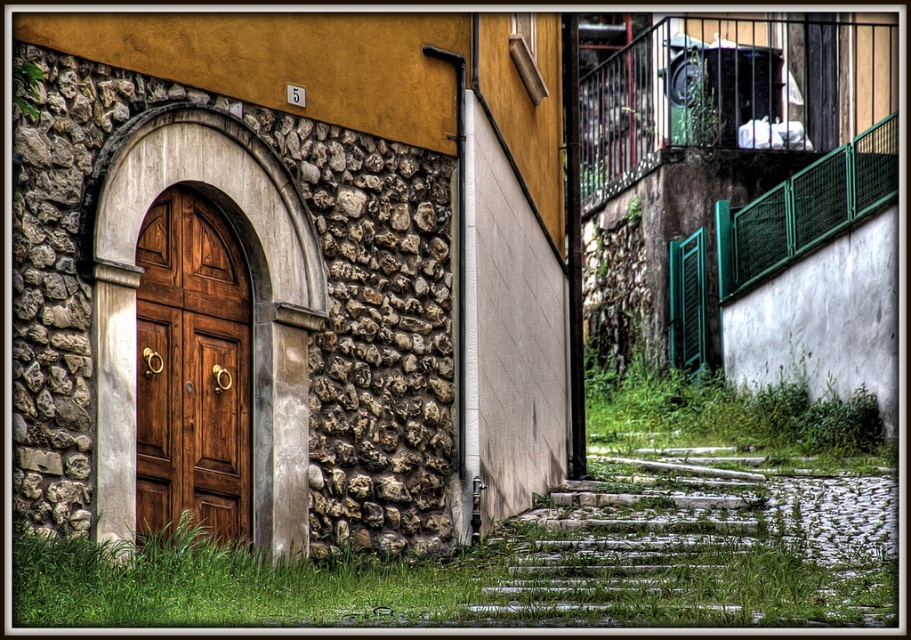
You are a painter hired to paint the rustic stone wall at left and the polished wood door at center left. Which object requires more paint due to its size?

The rustic stone wall at left requires more paint because it has a larger size compared to the polished wood door at center left.

You are standing at point (x=229, y=320) in the image. What is the object directly in front of you?

The object directly in front of you at point (x=229, y=320) is the rustic stone wall at left.

You are a painter who needs to decide which surface to paint first. Based on the scene, which object is taller between the rustic stone wall at left and the polished wood door at center left?

The rustic stone wall at left is much taller than the polished wood door at center left, so you should paint the rustic stone wall at left first.